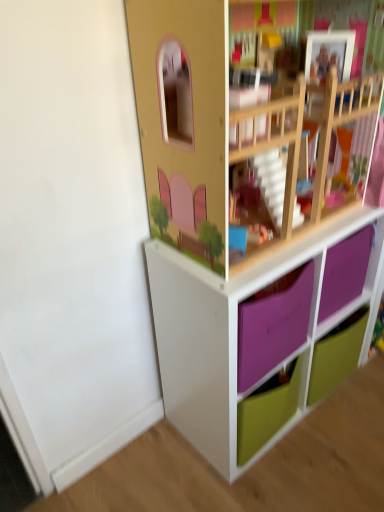
Where is `free space in front of green matte drawer at lower right`? free space in front of green matte drawer at lower right is located at coordinates (340, 428).